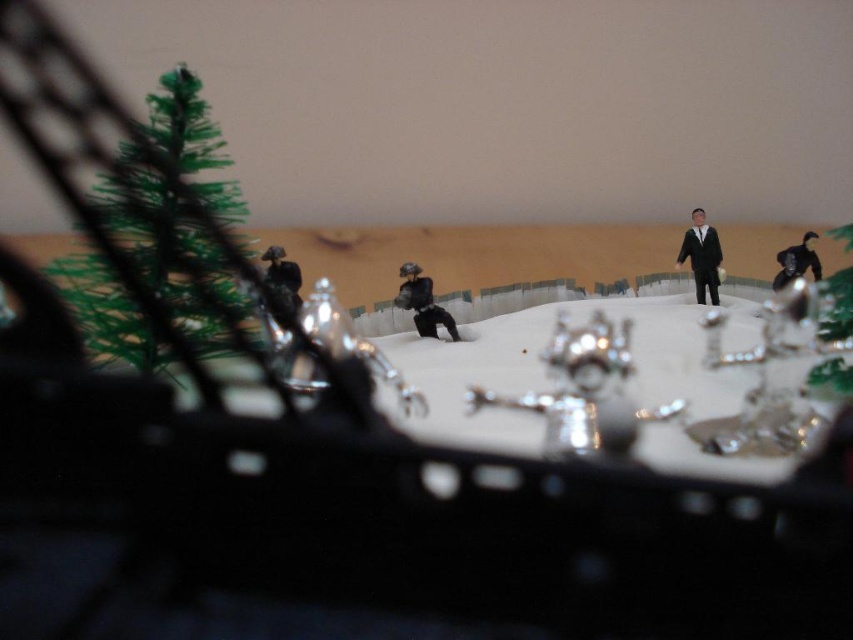
Does point (601, 365) come closer to viewer compared to point (405, 269)?

Yes, point (601, 365) is closer to viewer.

Is shiny silver ornament at center behind matte black figure at center?

No, shiny silver ornament at center is in front of matte black figure at center.

Identify the location of shiny silver ornament at center. (584, 390).

This screenshot has height=640, width=853. Describe the element at coordinates (584, 390) in the screenshot. I see `shiny silver ornament at center` at that location.

Is point (558, 396) behind point (784, 268)?

That is False.

This screenshot has height=640, width=853. I want to click on shiny silver ornament at center, so click(584, 390).

Which is more to the right, shiny silver ornament at center or black matte suit at center?

black matte suit at center is more to the right.

Which of these two, shiny silver ornament at center or black matte suit at center, stands taller?

black matte suit at center is taller.

The image size is (853, 640). Identify the location of shiny silver ornament at center. (584, 390).

At what (x,y) coordinates should I click in order to perform the action: click on shiny silver ornament at center. Please return your answer as a coordinate pair (x, y). The height and width of the screenshot is (640, 853). Looking at the image, I should click on (584, 390).